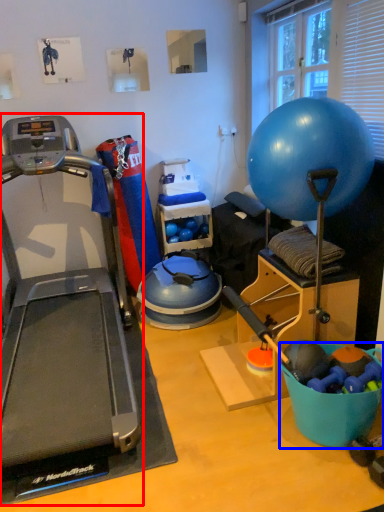
Question: Which object appears closest to the camera in this image, treadmill (highlighted by a red box) or bowl (highlighted by a blue box)?

Choices:
 (A) treadmill
 (B) bowl

Answer: (A)